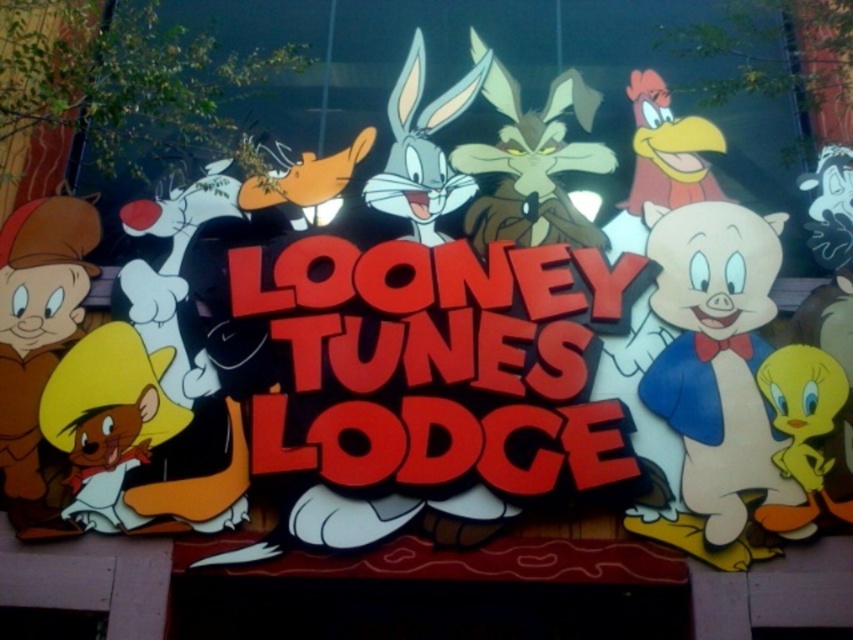
Is white paper pig at right behind brown matte/tanned skin at left?

No, white paper pig at right is in front of brown matte/tanned skin at left.

Does point (692, 310) come in front of point (74, 268)?

Yes, point (692, 310) is closer to viewer.

The image size is (853, 640). What do you see at coordinates (717, 349) in the screenshot?
I see `white paper pig at right` at bounding box center [717, 349].

This screenshot has height=640, width=853. I want to click on white paper pig at right, so click(x=717, y=349).